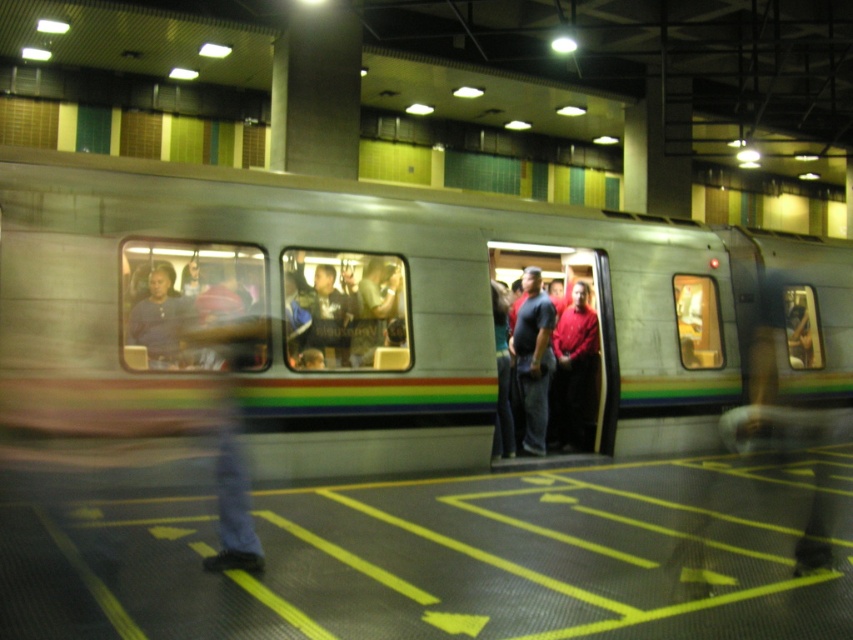
You are a passenger waiting on the subway platform. You notice a metallic silver train at center and a person wearing a matte blue shirt at left. Which object is taller?

The metallic silver train at center is much taller than the matte blue shirt at left.

You are a photographer standing on the subway platform. You notice two items of clothing in the scene. The dark blue jeans at center and the matte blue shirt at left. Which item of clothing appears bigger in the photo?

The dark blue jeans at center appears bigger in the photo than the matte blue shirt at left because it is larger in size.